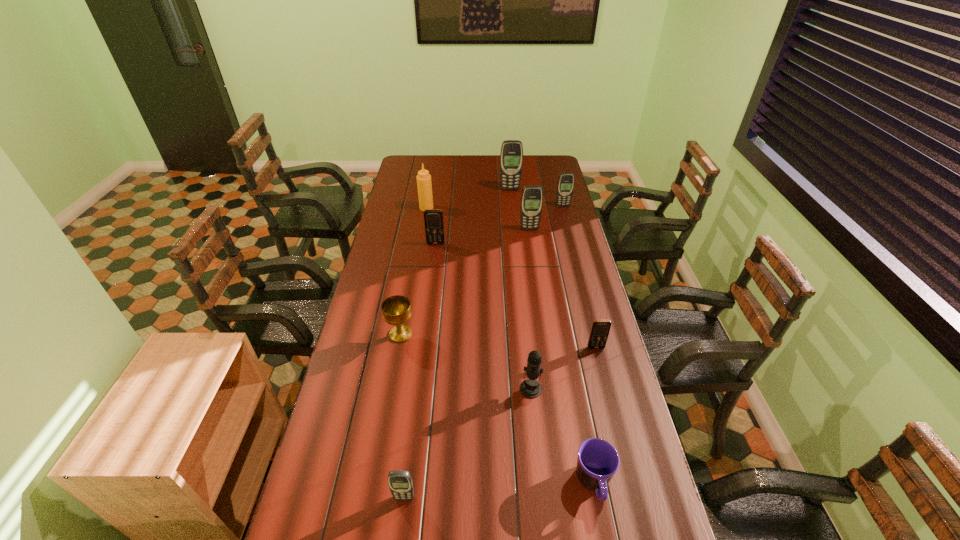
Where is `vacant region at the far edge of the desktop`? vacant region at the far edge of the desktop is located at coordinates (491, 160).

In the image, there is a desktop. At what (x,y) coordinates should I click in order to perform the action: click on vacant area at the left edge. Please return your answer as a coordinate pair (x, y). This screenshot has width=960, height=540. Looking at the image, I should click on (409, 199).

Where is `vacant area at the right edge`? vacant area at the right edge is located at coordinates (561, 292).

Locate an element on the screen. The width and height of the screenshot is (960, 540). free space that is in between the third nearest cellular telephone and the black microphone is located at coordinates (484, 316).

Where is `vacant space that is in between the farthest object and the fifth nearest object`? The height and width of the screenshot is (540, 960). vacant space that is in between the farthest object and the fifth nearest object is located at coordinates (455, 262).

Locate an element on the screen. This screenshot has width=960, height=540. empty space that is in between the farthest gray cellular telephone and the left orange cellular telephone is located at coordinates (473, 217).

Locate an element on the screen. Image resolution: width=960 pixels, height=540 pixels. empty location between the third farthest cellular telephone and the bigger orange cellular telephone is located at coordinates (483, 237).

You are a GUI agent. You are given a task and a screenshot of the screen. Output one action in this format:
    pyautogui.click(x=<x>, y=<y>)
    Task: Click on the vacant area that lies between the nearer orange cellular telephone and the eighth farthest object
    
    Given the screenshot: What is the action you would take?
    pyautogui.click(x=564, y=368)

Find the location of a particular element. This screenshot has height=540, width=960. free space that is in between the condiment and the third biggest gray cellular telephone is located at coordinates (494, 207).

Where is `free area in between the second nearest cellular telephone and the chalice`? This screenshot has width=960, height=540. free area in between the second nearest cellular telephone and the chalice is located at coordinates (498, 341).